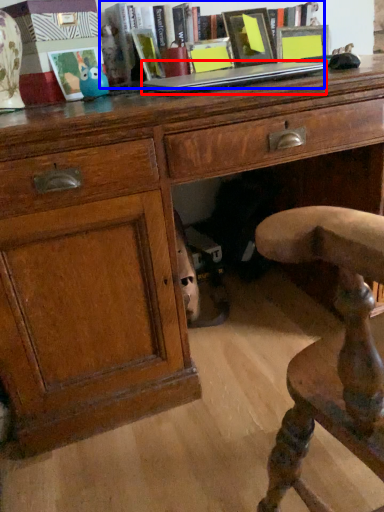
Question: Among these objects, which one is nearest to the camera, laptop (highlighted by a red box) or book (highlighted by a blue box)?

Choices:
 (A) laptop
 (B) book

Answer: (A)